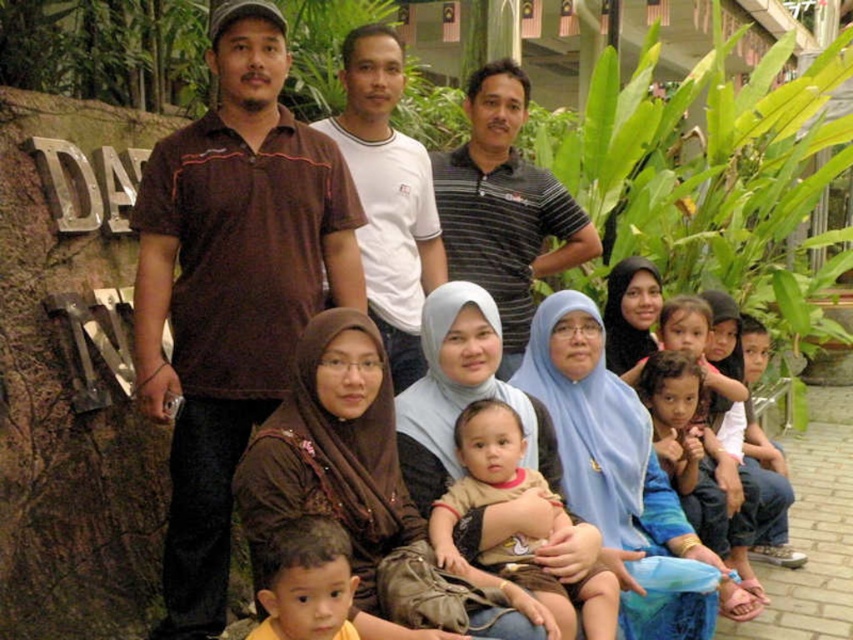
Question: Is brown cotton shirt at left below brown cotton shirt at center?

Choices:
 (A) no
 (B) yes

Answer: (A)

Question: Which of these objects is positioned farthest from the striped polo shirt at upper center?

Choices:
 (A) brown cotton shirt at center
 (B) brown hair at center

Answer: (B)

Question: Can you confirm if brown cotton shirt at left is positioned below brown hair at center?

Choices:
 (A) yes
 (B) no

Answer: (B)

Question: Which point is farther to the camera?

Choices:
 (A) striped polo shirt at upper center
 (B) brown hair at center
 (C) brown cotton shirt at center
 (D) brown cotton shirt at left

Answer: (A)

Question: Which point appears farthest from the camera in this image?

Choices:
 (A) (231, 236)
 (B) (492, 497)

Answer: (A)

Question: Does striped polo shirt at upper center have a lesser width compared to brown cotton shirt at center?

Choices:
 (A) yes
 (B) no

Answer: (B)